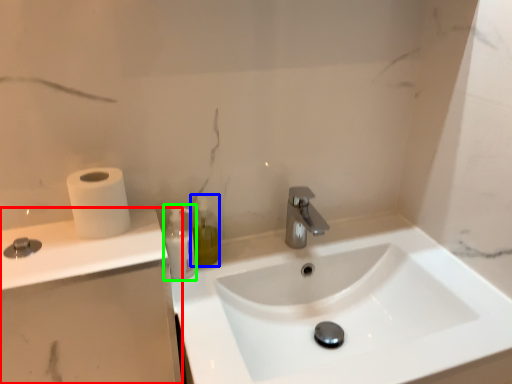
Question: Which object is the farthest from counter top (highlighted by a red box)? Choose among these: soap dispenser (highlighted by a blue box) or mouthwash (highlighted by a green box).

Choices:
 (A) soap dispenser
 (B) mouthwash

Answer: (A)